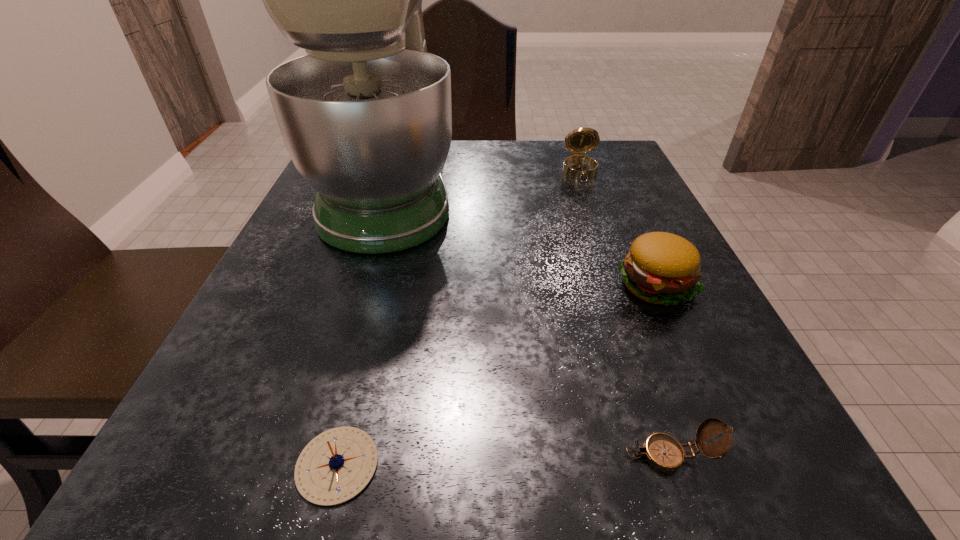
Find the location of a particular element. The image size is (960, 540). vacant space at the right edge is located at coordinates (729, 385).

Identify the location of vacant space at the near left corner of the desktop. The width and height of the screenshot is (960, 540). (252, 471).

The width and height of the screenshot is (960, 540). I want to click on free space at the near right corner of the desktop, so click(x=712, y=496).

This screenshot has width=960, height=540. I want to click on blank region between the third nearest object and the leftmost compass, so click(x=497, y=375).

Locate an element on the screen. This screenshot has width=960, height=540. unoccupied position between the mixer and the leftmost compass is located at coordinates (364, 327).

Find the location of a particular element. free area in between the tallest compass and the third nearest object is located at coordinates (618, 229).

The height and width of the screenshot is (540, 960). I want to click on free space between the leftmost compass and the tallest compass, so click(459, 318).

Locate an element on the screen. empty location between the hamburger and the tallest compass is located at coordinates (618, 229).

You are a GUI agent. You are given a task and a screenshot of the screen. Output one action in this format:
    pyautogui.click(x=<x>, y=<y>)
    Task: Click on the vacant area that lies between the hamburger and the shortest compass
    
    Given the screenshot: What is the action you would take?
    pyautogui.click(x=497, y=375)

Locate an element on the screen. The width and height of the screenshot is (960, 540). free point between the hamburger and the shortest object is located at coordinates (497, 375).